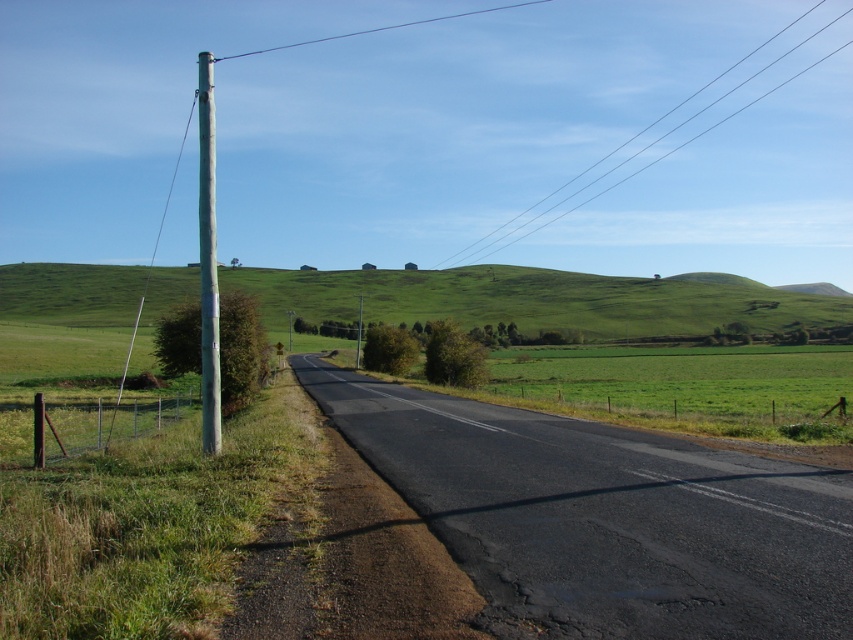
Can you confirm if clear wire at upper center is thinner than metallic gray pole at left?

Incorrect, clear wire at upper center's width is not less than metallic gray pole at left's.

Can you confirm if clear wire at upper center is shorter than metallic gray pole at left?

Yes, clear wire at upper center is shorter than metallic gray pole at left.

Does point (569, 204) come closer to viewer compared to point (212, 356)?

No, (569, 204) is further to viewer.

The width and height of the screenshot is (853, 640). In order to click on clear wire at upper center in this screenshot , I will do `click(660, 136)`.

Describe the element at coordinates (532, 300) in the screenshot. The height and width of the screenshot is (640, 853). I see `green grassy hillside at upper center` at that location.

Does green grassy hillside at upper center have a lesser height compared to clear wire at upper center?

Indeed, green grassy hillside at upper center has a lesser height compared to clear wire at upper center.

The height and width of the screenshot is (640, 853). What are the coordinates of `green grassy hillside at upper center` in the screenshot? It's located at (532, 300).

Locate an element on the screen. The width and height of the screenshot is (853, 640). green grassy hillside at upper center is located at coordinates (532, 300).

Who is positioned more to the left, green grassy hillside at upper center or metallic gray pole at left?

From the viewer's perspective, metallic gray pole at left appears more on the left side.

Does green grassy hillside at upper center appear under metallic gray pole at left?

Yes.

This screenshot has height=640, width=853. Describe the element at coordinates (532, 300) in the screenshot. I see `green grassy hillside at upper center` at that location.

This screenshot has width=853, height=640. I want to click on green grassy hillside at upper center, so click(532, 300).